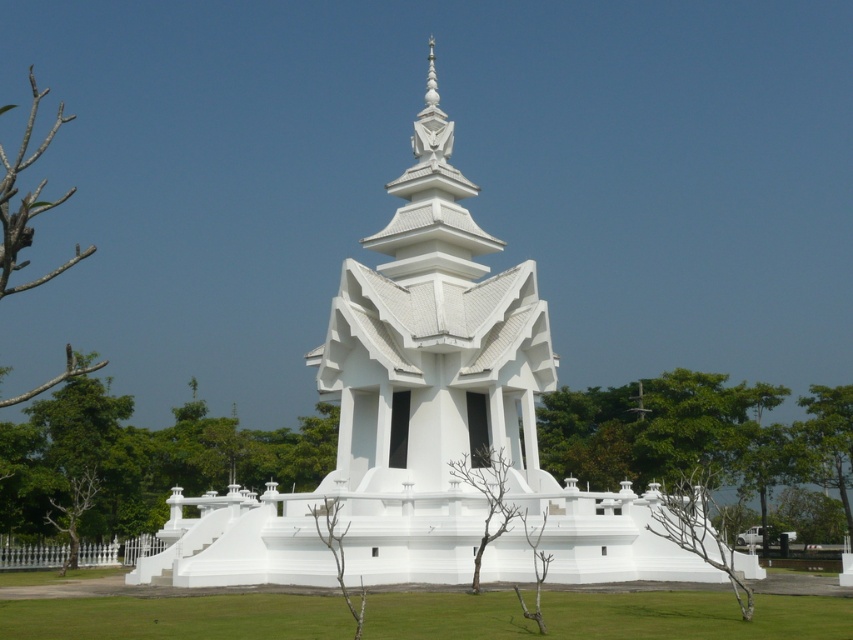
Consider the image. You are standing in front of the white monument and notice two trees nearby. The green leafy tree at lower left and the bare branches at left. Which tree is wider?

The green leafy tree at lower left has a lesser width compared to the bare branches at left, so the bare branches at left are wider.